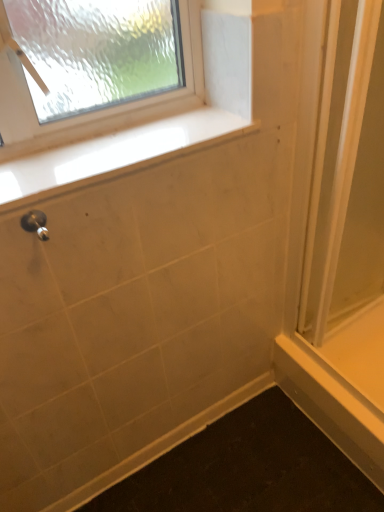
Question: From a real-world perspective, is clear plastic screen door at right positioned under matte silver shower at lower left based on gravity?

Choices:
 (A) yes
 (B) no

Answer: (A)

Question: Considering the relative sizes of clear plastic screen door at right and matte silver shower at lower left in the image provided, is clear plastic screen door at right shorter than matte silver shower at lower left?

Choices:
 (A) no
 (B) yes

Answer: (A)

Question: Considering the relative sizes of clear plastic screen door at right and matte silver shower at lower left in the image provided, is clear plastic screen door at right thinner than matte silver shower at lower left?

Choices:
 (A) no
 (B) yes

Answer: (A)

Question: Is clear plastic screen door at right oriented towards matte silver shower at lower left?

Choices:
 (A) no
 (B) yes

Answer: (A)

Question: Are clear plastic screen door at right and matte silver shower at lower left beside each other?

Choices:
 (A) yes
 (B) no

Answer: (B)

Question: From the image's perspective, relative to clear plastic screen door at right, is white glossy window sill at upper center above or below?

Choices:
 (A) above
 (B) below

Answer: (A)

Question: Is white glossy window sill at upper center spatially inside clear plastic screen door at right, or outside of it?

Choices:
 (A) inside
 (B) outside

Answer: (B)

Question: From a real-world perspective, is white glossy window sill at upper center above or below clear plastic screen door at right?

Choices:
 (A) below
 (B) above

Answer: (B)

Question: Relative to clear plastic screen door at right, is white glossy window sill at upper center in front or behind?

Choices:
 (A) front
 (B) behind

Answer: (A)

Question: In the image, is matte silver shower at lower left positioned in front of or behind white glossy window sill at upper center?

Choices:
 (A) behind
 (B) front

Answer: (B)

Question: From the image's perspective, relative to white glossy window sill at upper center, is matte silver shower at lower left above or below?

Choices:
 (A) above
 (B) below

Answer: (B)

Question: Considering the positions of point 23,224 and point 178,148, is point 23,224 closer or farther from the camera than point 178,148?

Choices:
 (A) farther
 (B) closer

Answer: (B)

Question: Looking at their shapes, would you say matte silver shower at lower left is wider or thinner than white glossy window sill at upper center?

Choices:
 (A) wide
 (B) thin

Answer: (B)

Question: In the image, is clear plastic screen door at right positioned in front of or behind matte silver shower at lower left?

Choices:
 (A) behind
 (B) front

Answer: (A)

Question: Is clear plastic screen door at right bigger or smaller than matte silver shower at lower left?

Choices:
 (A) small
 (B) big

Answer: (B)